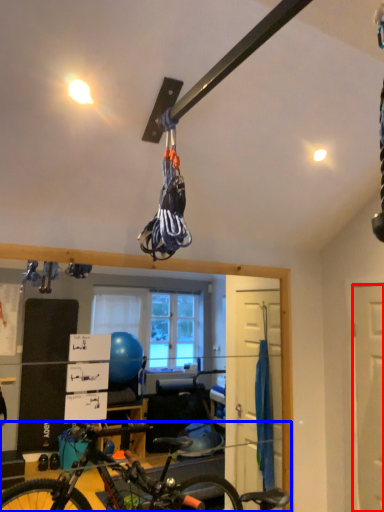
Question: Which point is closer to the camera, door (highlighted by a red box) or bicycle (highlighted by a blue box)?

Choices:
 (A) door
 (B) bicycle

Answer: (B)